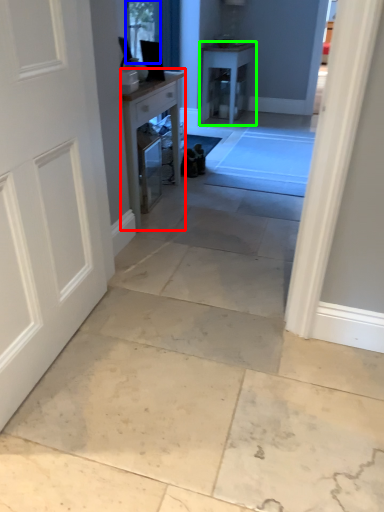
Question: Which is farther away from table (highlighted by a red box)? window screen (highlighted by a blue box) or table (highlighted by a green box)?

Choices:
 (A) window screen
 (B) table

Answer: (B)